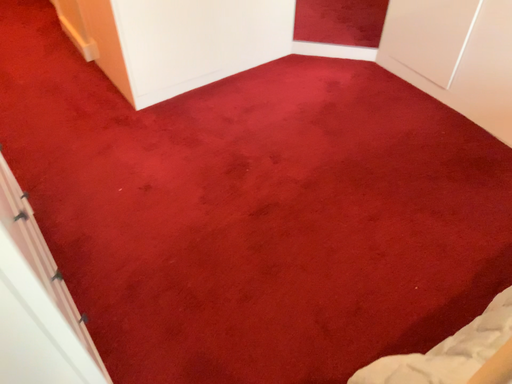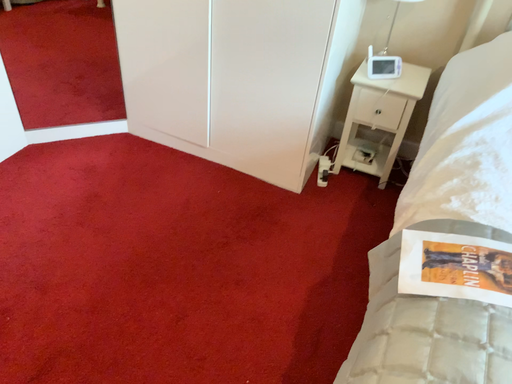
Question: Which way did the camera rotate in the video?

Choices:
 (A) rotated upward
 (B) rotated downward

Answer: (A)